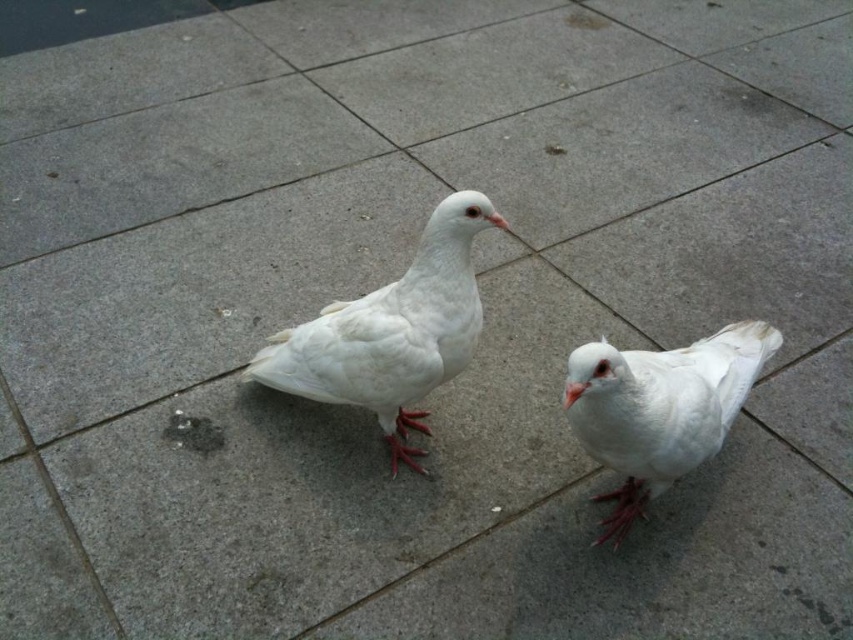
Question: Estimate the real-world distances between objects in this image. Which object is closer to the white matte beak at center?

Choices:
 (A) orange matte beak at center
 (B) white matte bird at center
 (C) white matte pigeon at center

Answer: (A)

Question: Which point is farther to the camera?

Choices:
 (A) white matte beak at center
 (B) white matte pigeon at center
 (C) white matte bird at center

Answer: (A)

Question: Considering the real-world distances, which object is farthest from the white matte pigeon at center?

Choices:
 (A) white matte beak at center
 (B) white matte bird at center
 (C) orange matte beak at center

Answer: (A)

Question: In this image, where is white matte bird at center located relative to white matte pigeon at center?

Choices:
 (A) below
 (B) above

Answer: (B)

Question: Does white matte bird at center have a lesser width compared to orange matte beak at center?

Choices:
 (A) yes
 (B) no

Answer: (B)

Question: Observing the image, what is the correct spatial positioning of white matte bird at center in reference to white matte pigeon at center?

Choices:
 (A) above
 (B) below

Answer: (A)